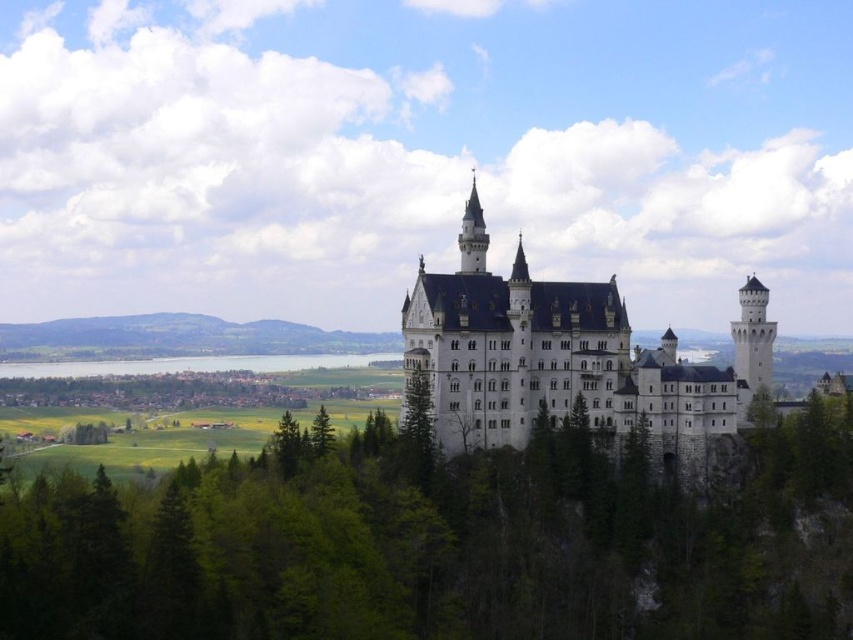
Is green leafy trees at center above white stone castle at center?

Actually, green leafy trees at center is below white stone castle at center.

Who is shorter, green leafy trees at center or white stone castle at center?

Standing shorter between the two is green leafy trees at center.

Where is `green leafy trees at center`? This screenshot has height=640, width=853. green leafy trees at center is located at coordinates (444, 544).

What are the coordinates of `green leafy trees at center` in the screenshot? It's located at (444, 544).

Measure the distance between green leafy trees at center and clear blue water at lower center.

green leafy trees at center and clear blue water at lower center are 64.56 meters apart from each other.

Who is shorter, green leafy trees at center or clear blue water at lower center?

clear blue water at lower center

Which is in front, point (91, 593) or point (286, 362)?

Positioned in front is point (91, 593).

Where is `green leafy trees at center`? This screenshot has height=640, width=853. green leafy trees at center is located at coordinates (444, 544).

At what (x,y) coordinates should I click in order to perform the action: click on green leafy trees at center. Please return your answer as a coordinate pair (x, y). Image resolution: width=853 pixels, height=640 pixels. Looking at the image, I should click on (444, 544).

Is point (695, 531) farther from camera compared to point (323, 428)?

No, it is not.

You are a GUI agent. You are given a task and a screenshot of the screen. Output one action in this format:
    pyautogui.click(x=<x>, y=<y>)
    Task: Click on the green leafy trees at center
    
    Given the screenshot: What is the action you would take?
    pyautogui.click(x=444, y=544)